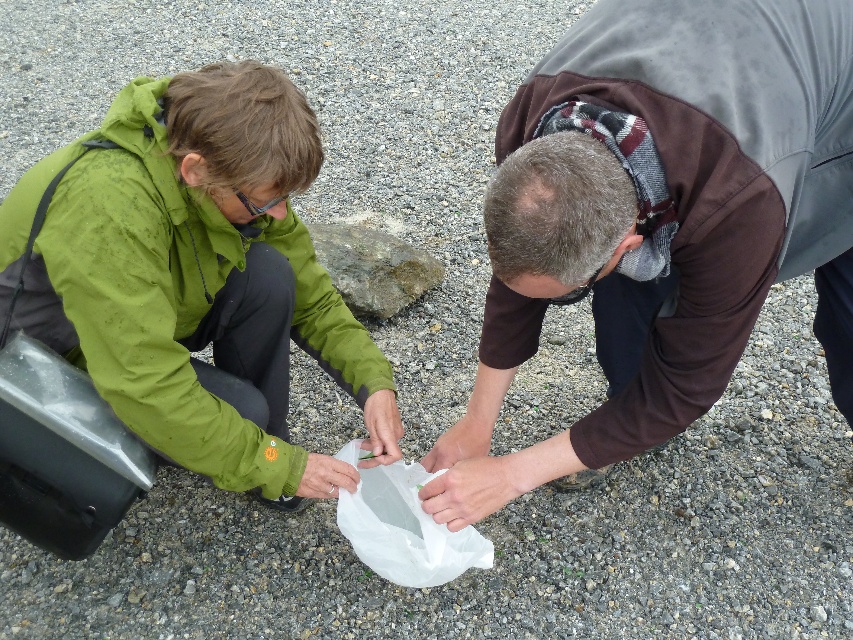
Based on the coordinates provided, which object corresponds to the point at (659, 221)?

The point at (659, 221) corresponds to the brown fleece jacket at center.

You are a photographer trying to capture a closeup of the transparent plastic bag at center. The brown fleece jacket at center is blocking your view. Can you move the jacket to get a clear shot?

The brown fleece jacket at center is located above the transparent plastic bag at center, so moving the jacket would allow you to see the bag clearly.

You are a photographer trying to capture a photo of the two people in the scene. Since you want to include both individuals in the frame, which direction should you position yourself relative to the green matte jacket at left and the brown fleece jacket at center?

You should position yourself to the left of the green matte jacket at left and to the right of the brown fleece jacket at center, as the brown fleece jacket at center is to the right of the green matte jacket at left.